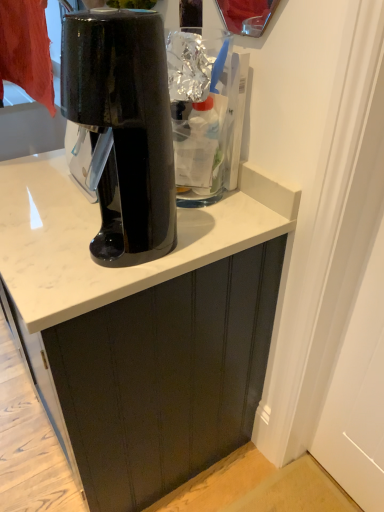
Question: Which is correct: glossy black coffee maker at center is inside matte black cabinet at center, or outside of it?

Choices:
 (A) inside
 (B) outside

Answer: (B)

Question: From the image's perspective, is glossy black coffee maker at center located above or below matte black cabinet at center?

Choices:
 (A) above
 (B) below

Answer: (A)

Question: Does point (160, 108) appear closer or farther from the camera than point (66, 281)?

Choices:
 (A) closer
 (B) farther

Answer: (A)

Question: From their relative heights in the image, would you say matte black cabinet at center is taller or shorter than glossy black coffee maker at center?

Choices:
 (A) short
 (B) tall

Answer: (A)

Question: Choose the correct answer: Is matte black cabinet at center inside glossy black coffee maker at center or outside it?

Choices:
 (A) outside
 (B) inside

Answer: (A)

Question: From the image's perspective, relative to glossy black coffee maker at center, is matte black cabinet at center above or below?

Choices:
 (A) below
 (B) above

Answer: (A)

Question: In terms of size, does matte black cabinet at center appear bigger or smaller than glossy black coffee maker at center?

Choices:
 (A) big
 (B) small

Answer: (A)